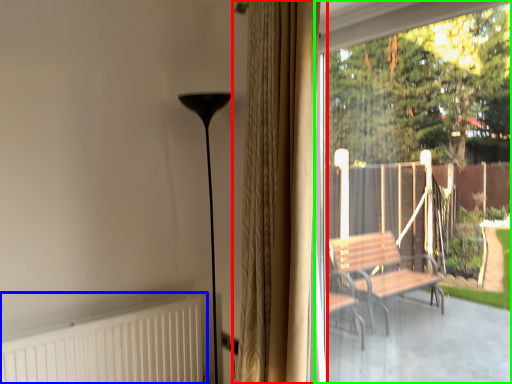
Question: Considering the real-world distances, which object is farthest from curtain (highlighted by a red box)? radiator (highlighted by a blue box) or window screen (highlighted by a green box)?

Choices:
 (A) radiator
 (B) window screen

Answer: (B)